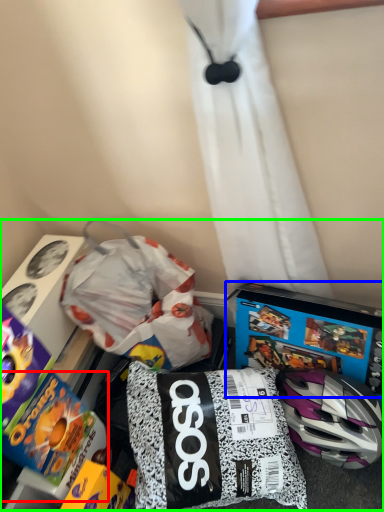
Question: Based on their relative distances, which object is nearer to toy (highlighted by a red box)? Choose from video game (highlighted by a blue box) and toy (highlighted by a green box).

Choices:
 (A) video game
 (B) toy

Answer: (B)